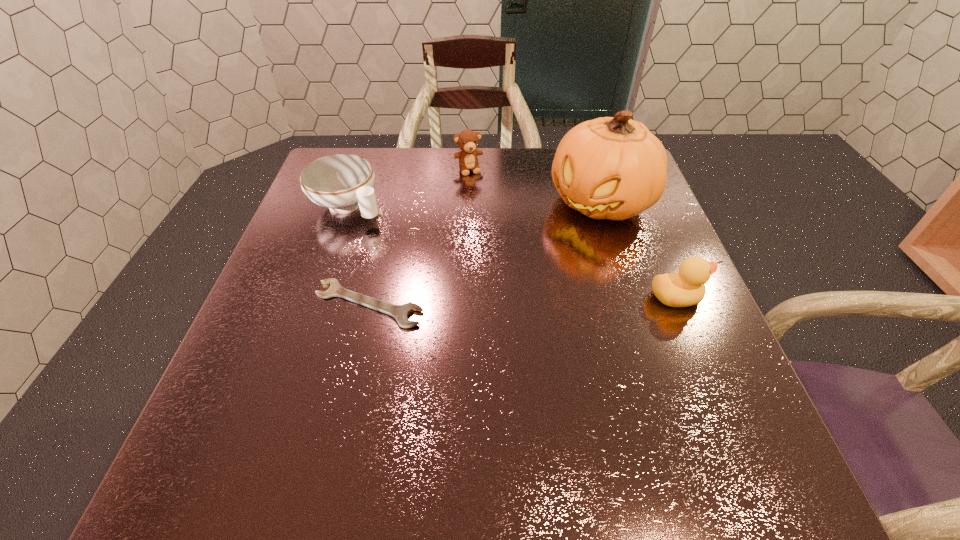
The height and width of the screenshot is (540, 960). In order to click on vacant space located 0.140m on the front face of the pumpkin in this screenshot , I will do `click(540, 259)`.

Where is `vacant space located 0.300m on the front face of the pumpkin`? vacant space located 0.300m on the front face of the pumpkin is located at coordinates (497, 300).

Where is `vacant region located 0.180m on the face of the third object from right to left`? vacant region located 0.180m on the face of the third object from right to left is located at coordinates (489, 214).

I want to click on vacant space located 0.190m on the face of the third object from right to left, so click(490, 217).

The height and width of the screenshot is (540, 960). In order to click on vacant area situated on the face of the third object from right to left in this screenshot , I will do `click(485, 205)`.

This screenshot has width=960, height=540. In order to click on chinaware positioned at the far edge in this screenshot , I will do `click(342, 182)`.

Locate an element on the screen. This screenshot has height=540, width=960. pumpkin positioned at the far edge is located at coordinates (614, 168).

At what (x,y) coordinates should I click in order to perform the action: click on teddy bear that is positioned at the far edge. Please return your answer as a coordinate pair (x, y). This screenshot has width=960, height=540. Looking at the image, I should click on click(467, 140).

I want to click on wrench located at the left edge, so click(x=400, y=312).

Where is `chinaware at the left edge`? The width and height of the screenshot is (960, 540). chinaware at the left edge is located at coordinates (342, 182).